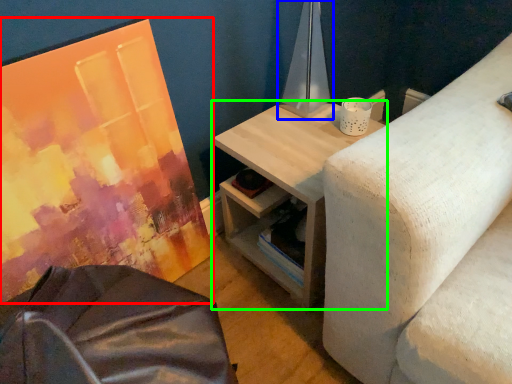
Question: Based on their relative distances, which object is nearer to canvas (highlighted by a red box)? Choose from table lamp (highlighted by a blue box) and table (highlighted by a green box).

Choices:
 (A) table lamp
 (B) table

Answer: (B)